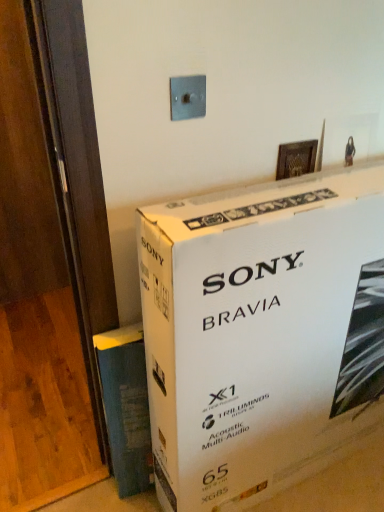
Question: Is blue textured paper at lower left to the right of wooden at left from the viewer's perspective?

Choices:
 (A) yes
 (B) no

Answer: (A)

Question: Is blue textured paper at lower left in contact with wooden at left?

Choices:
 (A) no
 (B) yes

Answer: (A)

Question: Is blue textured paper at lower left not near wooden at left?

Choices:
 (A) no
 (B) yes

Answer: (A)

Question: Does blue textured paper at lower left have a greater height compared to wooden at left?

Choices:
 (A) yes
 (B) no

Answer: (A)

Question: From the image's perspective, is blue textured paper at lower left below wooden at left?

Choices:
 (A) no
 (B) yes

Answer: (B)

Question: Is wooden at left situated inside metallic gray switch at upper center or outside?

Choices:
 (A) inside
 (B) outside

Answer: (B)

Question: Considering the positions of wooden at left and metallic gray switch at upper center in the image, is wooden at left wider or thinner than metallic gray switch at upper center?

Choices:
 (A) wide
 (B) thin

Answer: (A)

Question: Does point (69, 441) appear closer or farther from the camera than point (193, 88)?

Choices:
 (A) closer
 (B) farther

Answer: (B)

Question: From a real-world perspective, is wooden at left positioned above or below metallic gray switch at upper center?

Choices:
 (A) below
 (B) above

Answer: (A)

Question: Is metallic gray switch at upper center taller or shorter than wooden at left?

Choices:
 (A) short
 (B) tall

Answer: (B)

Question: Looking at the image, does metallic gray switch at upper center seem bigger or smaller compared to wooden at left?

Choices:
 (A) big
 (B) small

Answer: (B)

Question: Looking at their shapes, would you say metallic gray switch at upper center is wider or thinner than wooden at left?

Choices:
 (A) thin
 (B) wide

Answer: (A)

Question: In the image, is metallic gray switch at upper center positioned in front of or behind wooden at left?

Choices:
 (A) behind
 (B) front

Answer: (B)

Question: Considering the positions of blue textured paper at lower left and wooden at left in the image, is blue textured paper at lower left taller or shorter than wooden at left?

Choices:
 (A) tall
 (B) short

Answer: (A)

Question: Looking at their shapes, would you say blue textured paper at lower left is wider or thinner than wooden at left?

Choices:
 (A) thin
 (B) wide

Answer: (A)